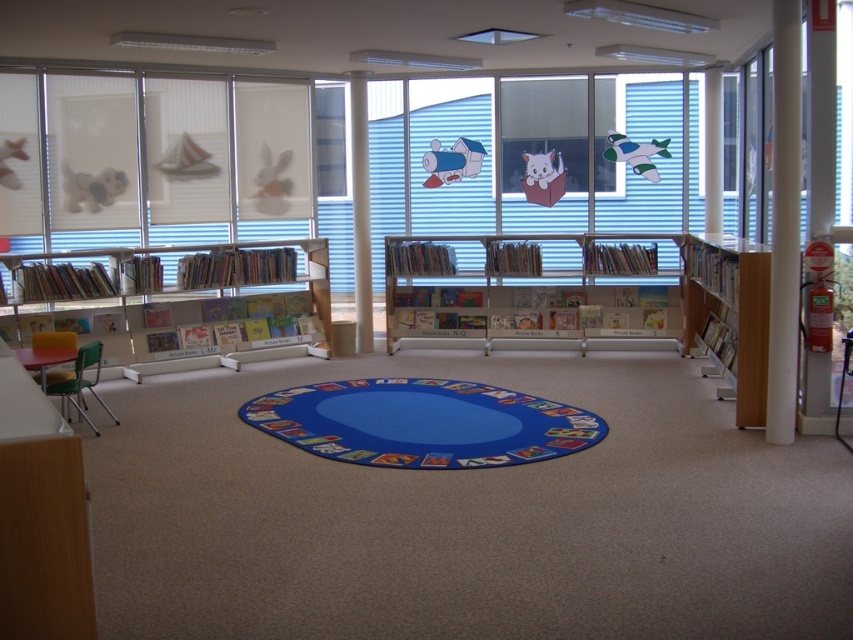
You are a parent trying to place a toy airplane on the blue fabric mat at center. The white matte rabbit at upper center is in the way. To move the toy airplane to the mat, should you move the rabbit to the left or the right?

The blue fabric mat at center is to the right of the white matte rabbit at upper center. To move the toy airplane to the mat, you should move the white matte rabbit to the left.

You are standing at the center of the children library. You want to place a new book on the wooden bookshelf at right. To do that, you need to walk towards it. In which direction should you move from your current position?

Since the wooden bookshelf at right is located at the right side of the room, you should move towards the right direction to reach it.